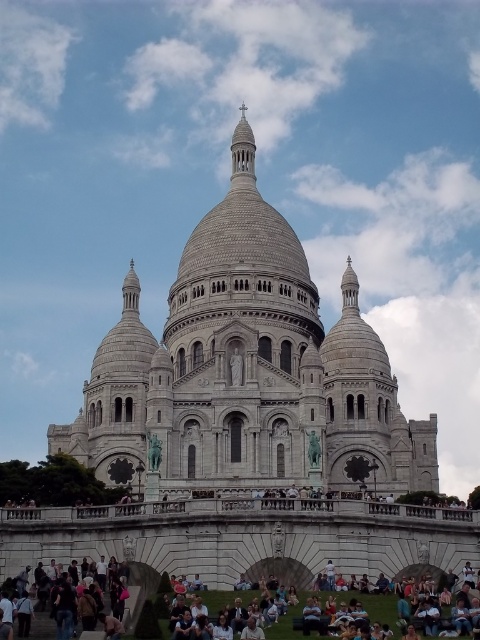
Question: Is light gray stone cathedral at center wider than dark blue jeans at lower center?

Choices:
 (A) yes
 (B) no

Answer: (A)

Question: Can you confirm if light gray stone cathedral at center is wider than dark blue jeans at lower center?

Choices:
 (A) yes
 (B) no

Answer: (A)

Question: Which point is closer to the camera?

Choices:
 (A) (214, 605)
 (B) (101, 435)

Answer: (A)

Question: Does light gray stone cathedral at center have a larger size compared to dark blue jeans at lower center?

Choices:
 (A) no
 (B) yes

Answer: (B)